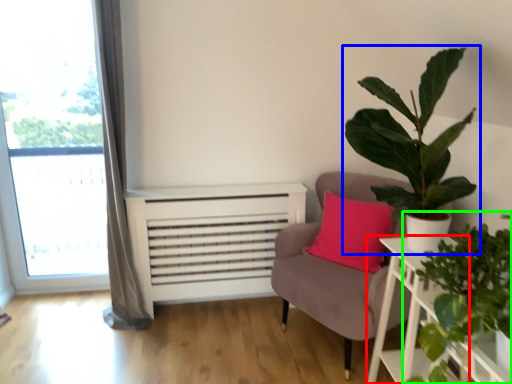
Question: Which is farther away from table (highlighted by a red box)? houseplant (highlighted by a blue box) or houseplant (highlighted by a green box)?

Choices:
 (A) houseplant
 (B) houseplant

Answer: (A)